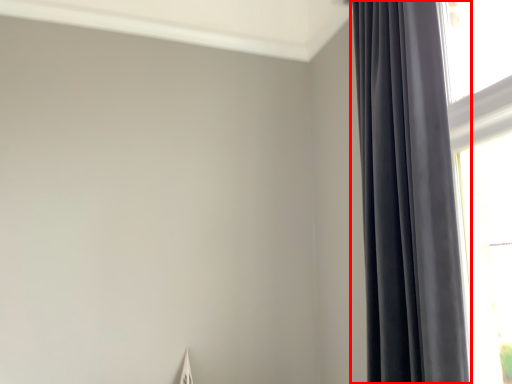
Question: From the image's perspective, considering the relative positions of curtain (annotated by the red box) and window in the image provided, where is curtain (annotated by the red box) located with respect to the staircase?

Choices:
 (A) above
 (B) below

Answer: (A)